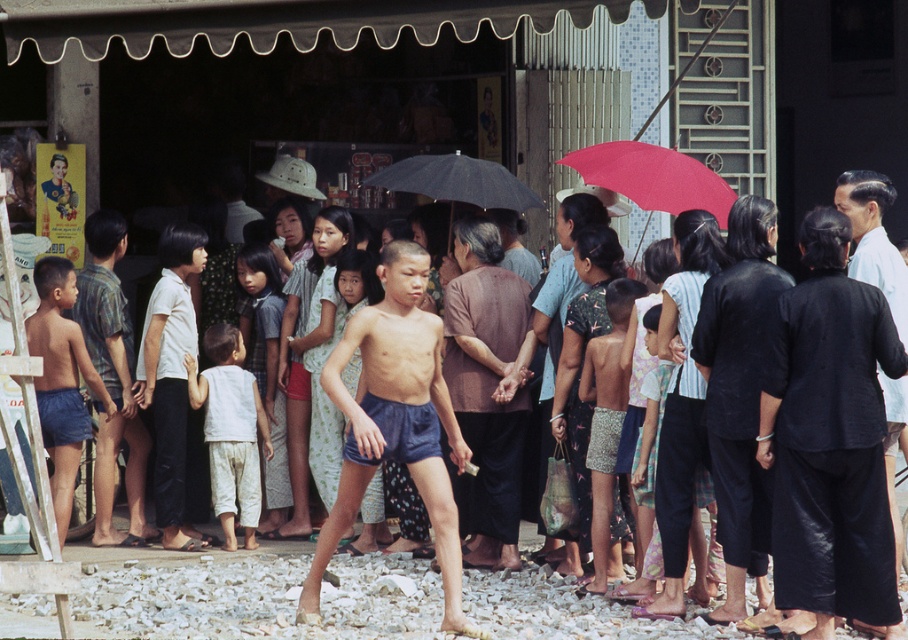
Is white cotton shirt at center to the left of red matte umbrella at upper center from the viewer's perspective?

Indeed, white cotton shirt at center is positioned on the left side of red matte umbrella at upper center.

Looking at this image, between white cotton shirt at center and red matte umbrella at upper center, which one has more height?

With more height is white cotton shirt at center.

Which is behind, point (253, 445) or point (617, 164)?

The point (253, 445) is more distant.

Identify the location of white cotton shirt at center. (230, 429).

Can you confirm if brown fabric shirt at center is positioned below red matte umbrella at upper center?

Yes, brown fabric shirt at center is below red matte umbrella at upper center.

Does brown fabric shirt at center have a larger size compared to red matte umbrella at upper center?

No, brown fabric shirt at center is not bigger than red matte umbrella at upper center.

Where is `brown fabric shirt at center`? This screenshot has width=908, height=640. brown fabric shirt at center is located at coordinates (486, 387).

Identify the location of brown fabric shirt at center. The width and height of the screenshot is (908, 640). (486, 387).

Which is more to the right, light blue shirt at center or black matte umbrella at center?

light blue shirt at center is more to the right.

Does light blue shirt at center have a lesser width compared to black matte umbrella at center?

Yes, light blue shirt at center is thinner than black matte umbrella at center.

Measure the distance between light blue shirt at center and camera.

light blue shirt at center and camera are 10.06 meters apart.

I want to click on light blue shirt at center, so click(x=873, y=237).